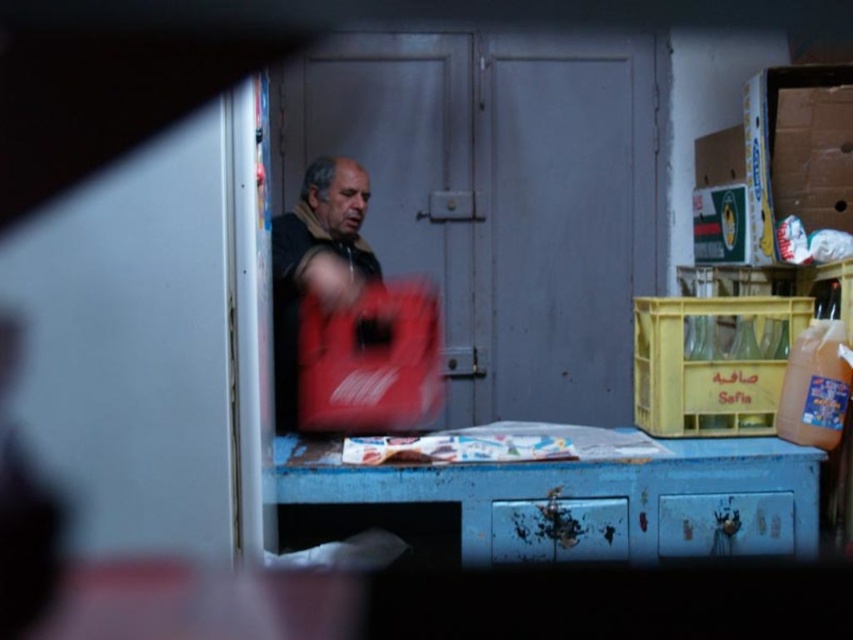
Does blue painted wood table at lower center appear on the right side of dark brown leather jacket at center?

Correct, you'll find blue painted wood table at lower center to the right of dark brown leather jacket at center.

Does blue painted wood table at lower center have a lesser height compared to dark brown leather jacket at center?

Correct, blue painted wood table at lower center is not as tall as dark brown leather jacket at center.

The height and width of the screenshot is (640, 853). What do you see at coordinates (587, 493) in the screenshot? I see `blue painted wood table at lower center` at bounding box center [587, 493].

You are a GUI agent. You are given a task and a screenshot of the screen. Output one action in this format:
    pyautogui.click(x=<x>, y=<y>)
    Task: Click on the blue painted wood table at lower center
    Image resolution: width=853 pixels, height=640 pixels.
    Given the screenshot: What is the action you would take?
    click(x=587, y=493)